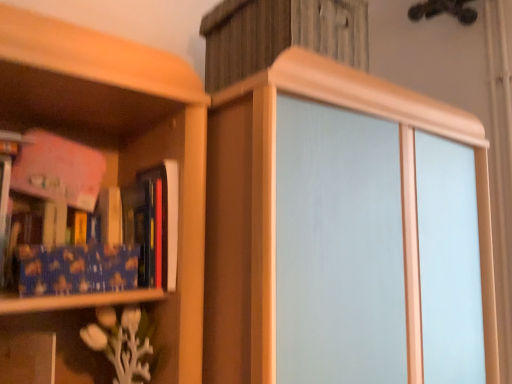
Question: Would you say white matte vase at lower left is inside or outside blue textured paper at left?

Choices:
 (A) outside
 (B) inside

Answer: (A)

Question: Looking at the image, does white matte vase at lower left seem bigger or smaller compared to blue textured paper at left?

Choices:
 (A) big
 (B) small

Answer: (A)

Question: Based on their relative distances, which object is farther from the blue textured paper at left?

Choices:
 (A) white matte vase at lower left
 (B) hardcover book at left, arranged as the first book when viewed from the right
 (C) blue textured fabric book at left, arranged as the 1th book when viewed from the left

Answer: (A)

Question: Estimate the real-world distances between objects in this image. Which object is farther from the hardcover book at left, positioned as the second book in left-to-right order?

Choices:
 (A) white matte vase at lower left
 (B) blue textured fabric book at left, the 2th book viewed from the right
 (C) blue textured paper at left

Answer: (A)